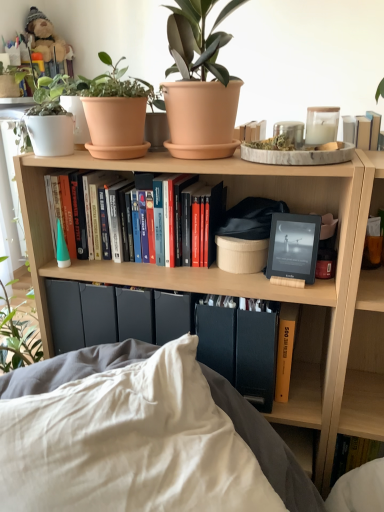
Question: Is terracotta clay pot at upper center in contact with hardcover books at center, placed as the 2th book when sorted from right to left?

Choices:
 (A) no
 (B) yes

Answer: (A)

Question: Is terracotta clay pot at upper center to the left of hardcover books at center, placed as the first book when sorted from left to right, from the viewer's perspective?

Choices:
 (A) no
 (B) yes

Answer: (B)

Question: Is terracotta clay pot at upper center turned away from hardcover books at center, the 1th book viewed from the top?

Choices:
 (A) yes
 (B) no

Answer: (B)

Question: Considering the relative sizes of terracotta clay pot at upper center and hardcover books at center, placed as the first book when sorted from left to right, in the image provided, is terracotta clay pot at upper center taller than hardcover books at center, placed as the first book when sorted from left to right,?

Choices:
 (A) yes
 (B) no

Answer: (B)

Question: Is terracotta clay pot at upper center bigger than hardcover books at center, the 2th book ordered from the bottom?

Choices:
 (A) no
 (B) yes

Answer: (A)

Question: From the image's perspective, would you say terracotta clay pot at upper center is positioned over hardcover books at center, placed as the first book when sorted from left to right?

Choices:
 (A) yes
 (B) no

Answer: (A)

Question: Is white soft pillow at lower center looking in the opposite direction of yellow matte book at lower right, which ranks as the second book in top-to-bottom order?

Choices:
 (A) yes
 (B) no

Answer: (A)

Question: From the image's perspective, is white soft pillow at lower center over yellow matte book at lower right, the 2th book in the left-to-right sequence?

Choices:
 (A) yes
 (B) no

Answer: (B)

Question: Can you confirm if white soft pillow at lower center is shorter than yellow matte book at lower right, the 2th book in the left-to-right sequence?

Choices:
 (A) yes
 (B) no

Answer: (B)

Question: Can you confirm if white soft pillow at lower center is wider than yellow matte book at lower right, which is the 1th book from bottom to top?

Choices:
 (A) yes
 (B) no

Answer: (A)

Question: Does white soft pillow at lower center have a larger size compared to yellow matte book at lower right, the 2th book in the left-to-right sequence?

Choices:
 (A) yes
 (B) no

Answer: (A)

Question: Is white soft pillow at lower center completely or partially outside of yellow matte book at lower right, which is the 1th book from bottom to top?

Choices:
 (A) no
 (B) yes

Answer: (B)

Question: Is terracotta pot at upper center further to the viewer compared to matte black e-reader at center?

Choices:
 (A) yes
 (B) no

Answer: (B)